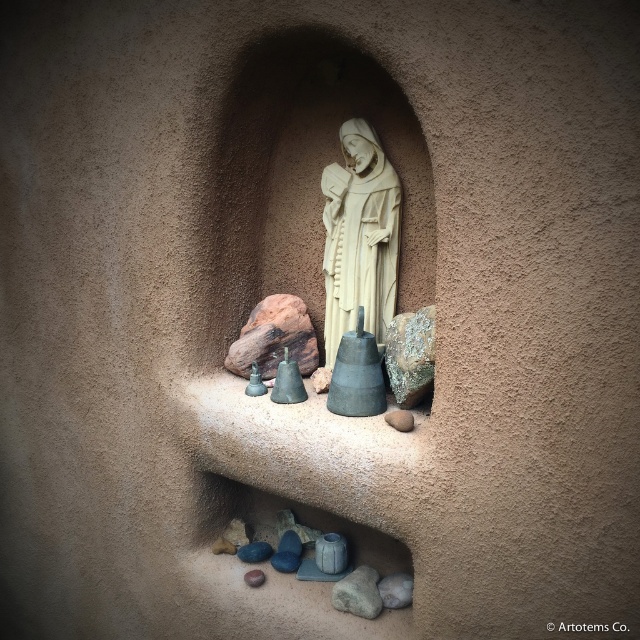
You are an interior designer planning to place a decorative item between the white stone statue at center and the smooth gray rock at center. The item you want to place is 10 inches long. Will there be enough space between them to fit the item?

The white stone statue at center is 12.96 inches from the smooth gray rock at center. Since the decorative item is 10 inches long, there is enough space to fit it between them.

You are an interior designer planning to place a small candle holder between the gray rough stone at center and the smooth gray rock at center. Which object should the candle holder be placed closer to if you want it to be near the larger one?

The gray rough stone at center is larger than the smooth gray rock at center, so the candle holder should be placed closer to the gray rough stone at center.

You are an architect designing a new religious space and want to place a statue in an alcove similar to the one shown. The statue will be positioned at the center of the alcove. Based on the image, where should you place the statue relative to the gray rough stone at center?

The statue should be placed at the center of the alcove, which is where the gray rough stone at center is located according to its coordinates at point (356, 593).